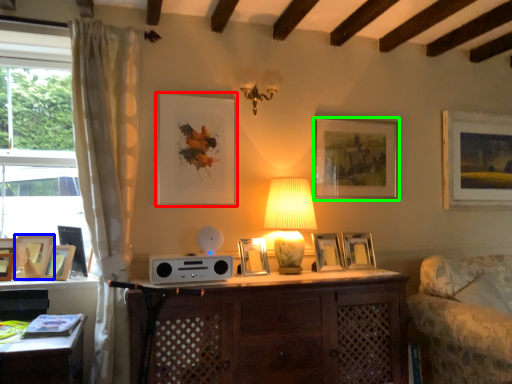
Question: Which object is positioned closest to picture frame (highlighted by a red box)? Select from picture frame (highlighted by a blue box) and picture frame (highlighted by a green box).

Choices:
 (A) picture frame
 (B) picture frame

Answer: (B)